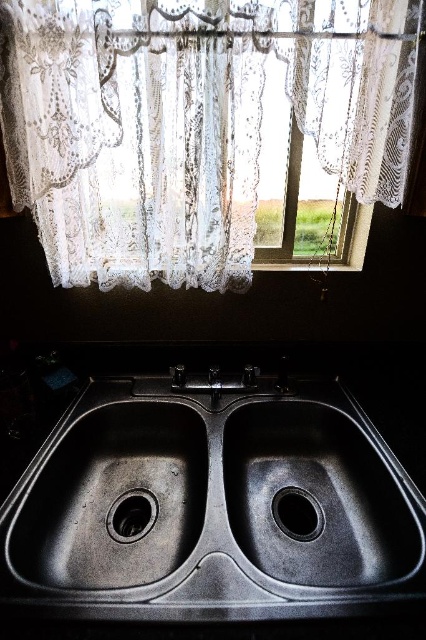
Question: Which point is closer to the camera?

Choices:
 (A) black rubber drain at center
 (B) black rubber drain at bottom center
 (C) black matte sink at center
 (D) white lace curtain at upper center

Answer: (C)

Question: Is white lace curtain at upper center below black rubber drain at bottom center?

Choices:
 (A) yes
 (B) no

Answer: (B)

Question: Estimate the real-world distances between objects in this image. Which object is farther from the black rubber drain at bottom center?

Choices:
 (A) white lace curtain at upper center
 (B) black rubber drain at center

Answer: (A)

Question: Is black matte sink at center thinner than black rubber drain at center?

Choices:
 (A) yes
 (B) no

Answer: (B)

Question: Does black matte sink at center have a greater width compared to black rubber drain at bottom center?

Choices:
 (A) no
 (B) yes

Answer: (B)

Question: Which object appears farthest from the camera in this image?

Choices:
 (A) black rubber drain at center
 (B) black matte sink at center

Answer: (A)